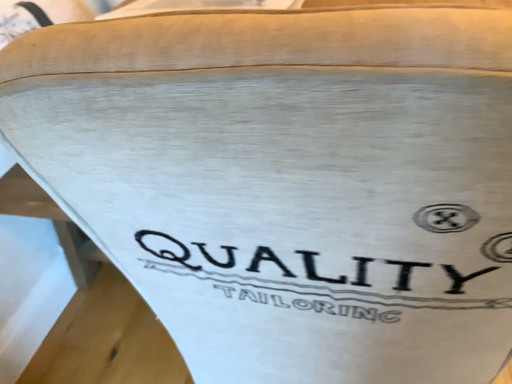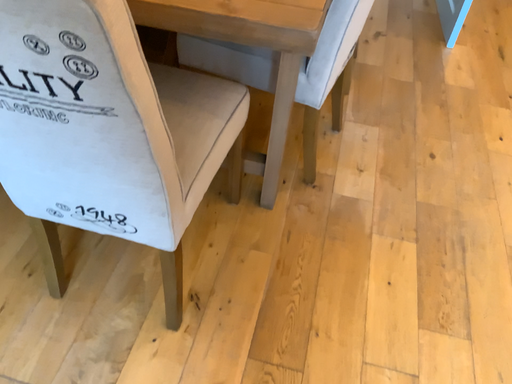
Question: Which way did the camera rotate in the video?

Choices:
 (A) rotated left
 (B) rotated right

Answer: (B)